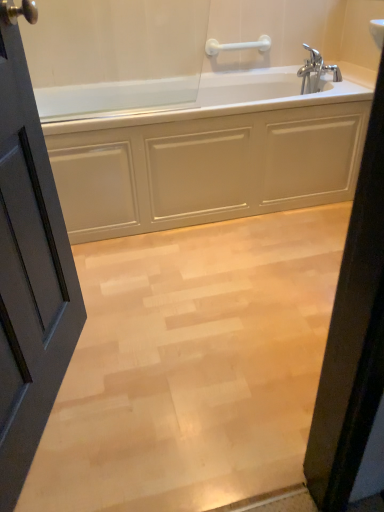
Question: Is there a large distance between chrome metallic faucet at upper right and light wood floor at center?

Choices:
 (A) no
 (B) yes

Answer: (B)

Question: Is chrome metallic faucet at upper right behind light wood floor at center?

Choices:
 (A) no
 (B) yes

Answer: (B)

Question: From the image's perspective, is chrome metallic faucet at upper right under light wood floor at center?

Choices:
 (A) no
 (B) yes

Answer: (A)

Question: Is chrome metallic faucet at upper right shorter than light wood floor at center?

Choices:
 (A) no
 (B) yes

Answer: (A)

Question: Is chrome metallic faucet at upper right turned away from light wood floor at center?

Choices:
 (A) yes
 (B) no

Answer: (B)

Question: Can you confirm if chrome metallic faucet at upper right is positioned to the right of light wood floor at center?

Choices:
 (A) no
 (B) yes

Answer: (B)

Question: Does chrome metallic faucet at upper right have a lesser width compared to white glossy bathtub at center?

Choices:
 (A) yes
 (B) no

Answer: (A)

Question: Considering the relative sizes of chrome metallic faucet at upper right and white glossy bathtub at center in the image provided, is chrome metallic faucet at upper right shorter than white glossy bathtub at center?

Choices:
 (A) yes
 (B) no

Answer: (A)

Question: Is chrome metallic faucet at upper right turned away from white glossy bathtub at center?

Choices:
 (A) no
 (B) yes

Answer: (A)

Question: Is chrome metallic faucet at upper right aimed at white glossy bathtub at center?

Choices:
 (A) no
 (B) yes

Answer: (B)

Question: Does chrome metallic faucet at upper right come in front of white glossy bathtub at center?

Choices:
 (A) yes
 (B) no

Answer: (B)

Question: From the image's perspective, is chrome metallic faucet at upper right located above white glossy bathtub at center?

Choices:
 (A) no
 (B) yes

Answer: (B)

Question: Is light wood floor at center with white glossy bathtub at center?

Choices:
 (A) no
 (B) yes

Answer: (A)